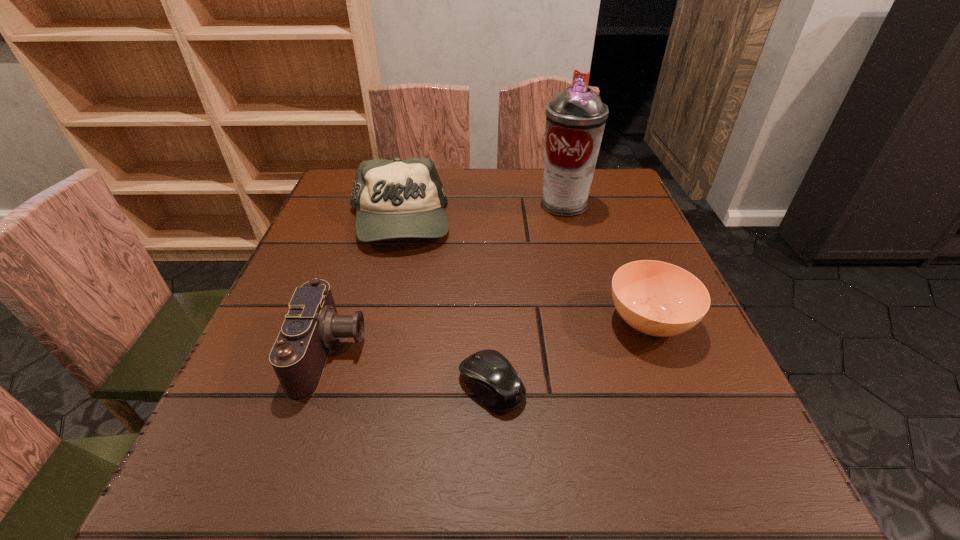
Where is `free space between the aerosol can and the baseball cap`? free space between the aerosol can and the baseball cap is located at coordinates (481, 213).

The height and width of the screenshot is (540, 960). Find the location of `free point between the baseball cap and the soup bowl`. free point between the baseball cap and the soup bowl is located at coordinates pyautogui.click(x=523, y=271).

This screenshot has width=960, height=540. I want to click on empty space between the second shortest object and the shortest object, so click(570, 353).

The width and height of the screenshot is (960, 540). In order to click on free space between the aerosol can and the shortest object in this screenshot , I will do `click(528, 295)`.

Find the location of a particular element. object that is the third closest to the shortest object is located at coordinates (397, 198).

Where is `object that is the second closest one to the tallest object`? This screenshot has height=540, width=960. object that is the second closest one to the tallest object is located at coordinates (656, 298).

Identify the location of blank space that satisfies the following two spatial constraints: 1. on the front side of the tallest object; 2. on the front-facing side of the third shortest object. (604, 353).

Find the location of a particular element. Image resolution: width=960 pixels, height=540 pixels. vacant space that satisfies the following two spatial constraints: 1. on the front-facing side of the shortest object; 2. on the left side of the camera is located at coordinates (321, 385).

Where is `free location that satisfies the following two spatial constraints: 1. on the front side of the soup bowl; 2. on the front-facing side of the third shortest object`? The height and width of the screenshot is (540, 960). free location that satisfies the following two spatial constraints: 1. on the front side of the soup bowl; 2. on the front-facing side of the third shortest object is located at coordinates (661, 353).

Where is `vacant point that satisfies the following two spatial constraints: 1. on the front-facing side of the shortest object; 2. on the right side of the camera`? The height and width of the screenshot is (540, 960). vacant point that satisfies the following two spatial constraints: 1. on the front-facing side of the shortest object; 2. on the right side of the camera is located at coordinates (321, 385).